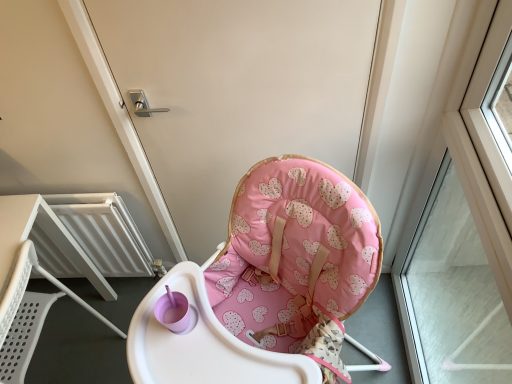
Question: Does transparent glass window at right come behind pink fabric highchair at center?

Choices:
 (A) no
 (B) yes

Answer: (A)

Question: Considering the relative sizes of transparent glass window at right and pink fabric highchair at center in the image provided, is transparent glass window at right wider than pink fabric highchair at center?

Choices:
 (A) no
 (B) yes

Answer: (B)

Question: From a real-world perspective, is transparent glass window at right on pink fabric highchair at center?

Choices:
 (A) yes
 (B) no

Answer: (B)

Question: Would you say pink fabric highchair at center is part of transparent glass window at right's contents?

Choices:
 (A) yes
 (B) no

Answer: (B)

Question: Considering the relative sizes of transparent glass window at right and pink fabric highchair at center in the image provided, is transparent glass window at right taller than pink fabric highchair at center?

Choices:
 (A) yes
 (B) no

Answer: (A)

Question: Considering the positions of point (30, 349) and point (454, 211), is point (30, 349) closer or farther from the camera than point (454, 211)?

Choices:
 (A) closer
 (B) farther

Answer: (A)

Question: Is white plastic chair at lower left wider or thinner than transparent glass window at right?

Choices:
 (A) wide
 (B) thin

Answer: (A)

Question: From a real-world perspective, is white plastic chair at lower left physically located above or below transparent glass window at right?

Choices:
 (A) above
 (B) below

Answer: (B)

Question: In the image, is white plastic chair at lower left positioned in front of or behind transparent glass window at right?

Choices:
 (A) front
 (B) behind

Answer: (B)

Question: From a real-world perspective, is transparent glass window at right above or below white plastic chair at lower left?

Choices:
 (A) below
 (B) above

Answer: (B)

Question: From the image's perspective, is transparent glass window at right above or below white plastic chair at lower left?

Choices:
 (A) below
 (B) above

Answer: (B)

Question: Is transparent glass window at right inside the boundaries of white plastic chair at lower left, or outside?

Choices:
 (A) inside
 (B) outside

Answer: (B)

Question: Based on their positions, is transparent glass window at right located to the left or right of white plastic chair at lower left?

Choices:
 (A) right
 (B) left

Answer: (A)

Question: From a real-world perspective, is pink fabric highchair at center physically located above or below transparent glass window at right?

Choices:
 (A) above
 (B) below

Answer: (A)

Question: Does point (220, 64) appear closer or farther from the camera than point (420, 286)?

Choices:
 (A) farther
 (B) closer

Answer: (B)